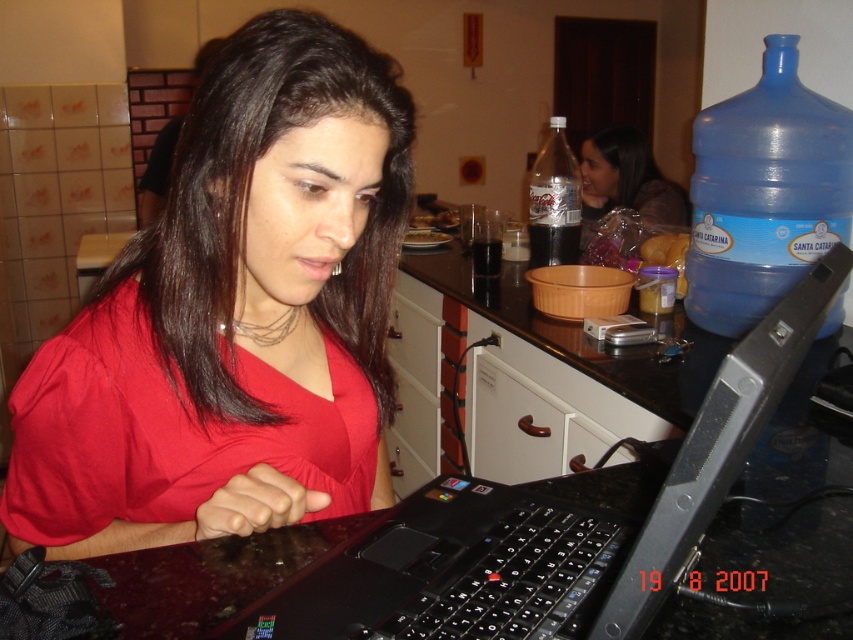
Who is higher up, black plastic laptop at center or blue plastic bottle at upper right?

Positioned higher is blue plastic bottle at upper right.

Is black plastic laptop at center in front of blue plastic bottle at upper right?

Yes, black plastic laptop at center is closer to the viewer.

Does point (451, 488) come farther from viewer compared to point (781, 244)?

No, (451, 488) is in front of (781, 244).

Identify the location of black plastic laptop at center. The image size is (853, 640). (553, 522).

Does matte red shirt at center have a smaller size compared to black plastic laptop at center?

Correct, matte red shirt at center occupies less space than black plastic laptop at center.

Is point (358, 417) closer to camera compared to point (509, 515)?

That is False.

Is point (265, 218) less distant than point (583, 499)?

Yes, point (265, 218) is in front of point (583, 499).

Where is `matte red shirt at center`? The width and height of the screenshot is (853, 640). matte red shirt at center is located at coordinates (233, 316).

Which is behind, point (757, 413) or point (554, 161)?

Positioned behind is point (554, 161).

Can you confirm if black plastic laptop at center is taller than clear plastic bottle at center?

Incorrect, black plastic laptop at center's height is not larger of clear plastic bottle at center's.

Which is behind, point (793, 356) or point (575, 259)?

The point (575, 259) is behind.

I want to click on black plastic laptop at center, so click(553, 522).